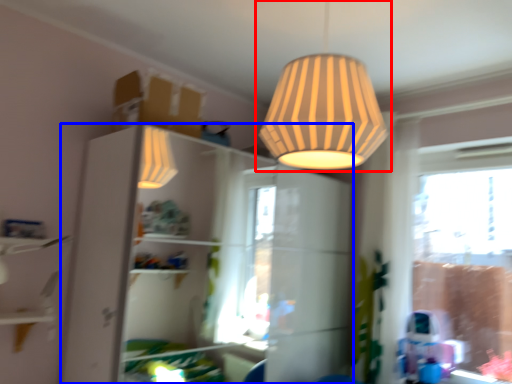
Question: Which of the following is the closest to the observer, lamp (highlighted by a red box) or dresser (highlighted by a blue box)?

Choices:
 (A) lamp
 (B) dresser

Answer: (A)